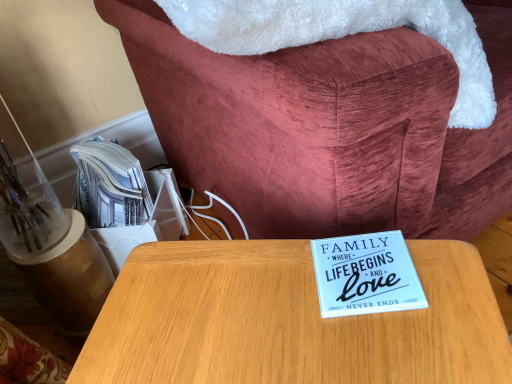
Question: Considering the positions of wooden table at center and wooden table at center in the image, is wooden table at center bigger or smaller than wooden table at center?

Choices:
 (A) small
 (B) big

Answer: (B)

Question: From their relative heights in the image, would you say wooden table at center is taller or shorter than wooden table at center?

Choices:
 (A) short
 (B) tall

Answer: (A)

Question: Would you say wooden table at center is to the left or to the right of wooden table at center in the picture?

Choices:
 (A) left
 (B) right

Answer: (B)

Question: Is wooden table at center inside the boundaries of wooden table at center, or outside?

Choices:
 (A) outside
 (B) inside

Answer: (A)

Question: Considering their positions, is wooden table at center located in front of or behind wooden table at center?

Choices:
 (A) front
 (B) behind

Answer: (A)

Question: From the image's perspective, is wooden table at center positioned above or below wooden table at center?

Choices:
 (A) below
 (B) above

Answer: (A)

Question: Considering the positions of wooden table at center and wooden table at center in the image, is wooden table at center wider or thinner than wooden table at center?

Choices:
 (A) wide
 (B) thin

Answer: (B)